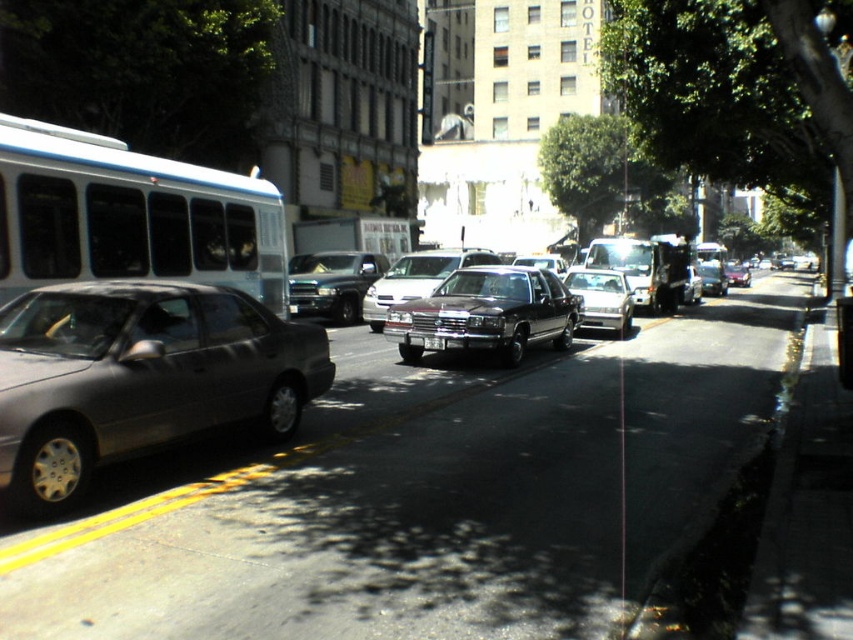
Question: Which of the following is the farthest from the observer?

Choices:
 (A) (6, 472)
 (B) (515, 266)
 (C) (428, 269)

Answer: (B)

Question: Which object is positioned closest to the shiny silver sedan at center?

Choices:
 (A) white matte bus at left
 (B) satin silver sedan at left
 (C) shiny black truck at center
 (D) shiny dark brown sedan at center

Answer: (D)

Question: Can you confirm if white matte bus at left is smaller than shiny black sedan at center?

Choices:
 (A) no
 (B) yes

Answer: (B)

Question: Is shiny black truck at center thinner than silver metallic license plate at center?

Choices:
 (A) yes
 (B) no

Answer: (B)

Question: Is shiny dark brown sedan at center smaller than shiny silver sedan at center?

Choices:
 (A) no
 (B) yes

Answer: (A)

Question: Based on their relative distances, which object is farther from the shiny black sedan at center?

Choices:
 (A) shiny dark brown sedan at center
 (B) shiny black truck at center
 (C) silver metallic license plate at center

Answer: (C)